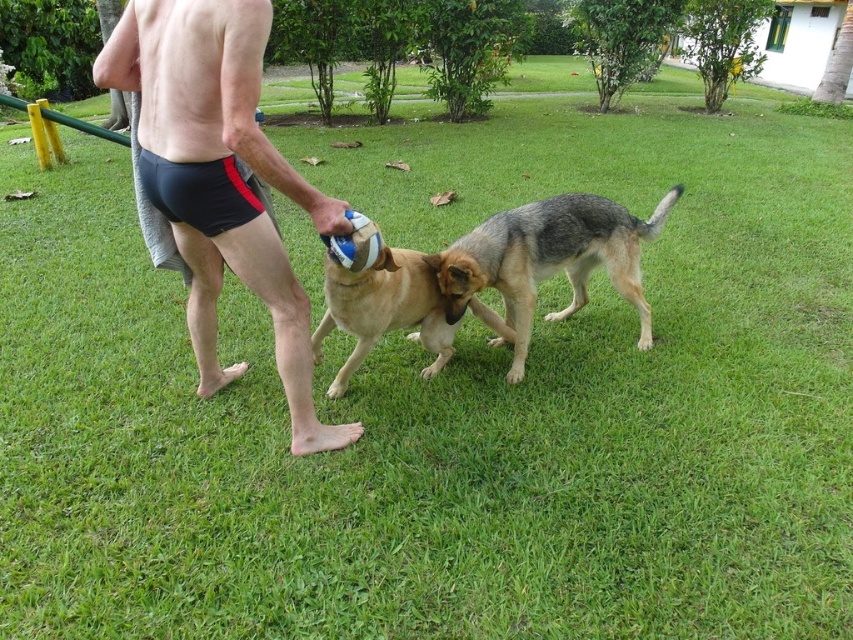
From the picture: A child wants to throw a frisbee from the point at coordinate point (219, 12) to another point 2.10 meters away. Is this possible within the scene?

The distance between the two points is 2.10 meters, so yes, the child can throw the frisbee from point (219, 12) to another point 2.10 meters away within the scene.

You are standing at the point with coordinates point (549, 259). Looking around, you see the gray and tan dog and the light brown dog. Which dog is directly in front of you?

The gray and tan dog is directly in front of you at point (549, 259).

You are a photographer trying to capture a clear shot of the black matte shorts at center and the golden fur dog at center. Which object should you focus on first to ensure it appears sharp in the photo?

You should focus on the black matte shorts at center first because it is closer to the viewer than the golden fur dog at center, so focusing on the closer object ensures it will be sharp.